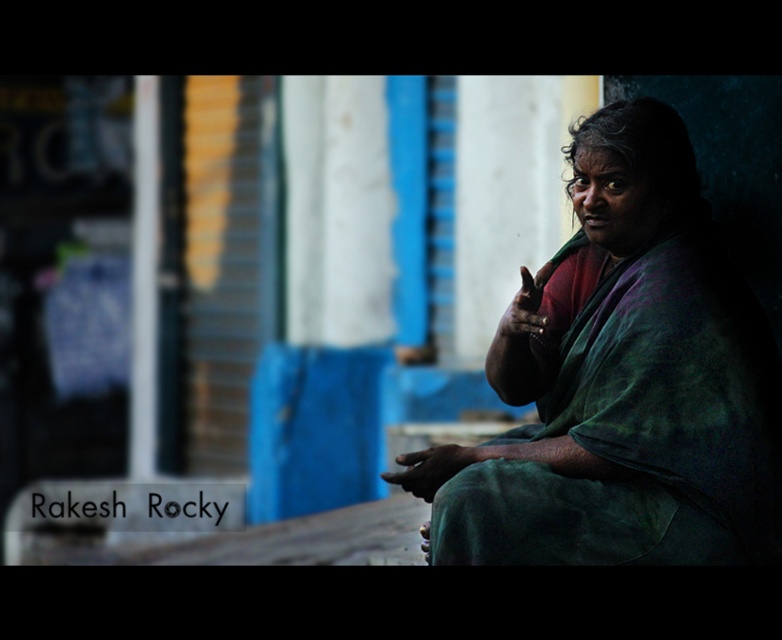
In the scene shown: Is green fabric at center further to camera compared to dark green fabric hand at lower center?

No, green fabric at center is in front of dark green fabric hand at lower center.

Who is lower down, green fabric at center or dark green fabric hand at lower center?

Positioned lower is dark green fabric hand at lower center.

Which is behind, point (678, 172) or point (407, 458)?

The point (407, 458) is behind.

Locate an element on the screen. Image resolution: width=782 pixels, height=640 pixels. green fabric at center is located at coordinates (630, 381).

Can you confirm if green fabric at center is positioned above matte green hand at center-right?

No.

Is green fabric at center further to the viewer compared to matte green hand at center-right?

No, it is not.

Who is more distant from viewer, (626, 378) or (522, 304)?

Point (522, 304)

Find the location of a particular element. Image resolution: width=782 pixels, height=640 pixels. green fabric at center is located at coordinates (630, 381).

Is dark green fabric hand at lower center thinner than matte green hand at center-right?

Incorrect, dark green fabric hand at lower center's width is not less than matte green hand at center-right's.

The width and height of the screenshot is (782, 640). Identify the location of dark green fabric hand at lower center. (429, 468).

At what (x,y) coordinates should I click in order to perform the action: click on dark green fabric hand at lower center. Please return your answer as a coordinate pair (x, y). This screenshot has width=782, height=640. Looking at the image, I should click on coord(429,468).